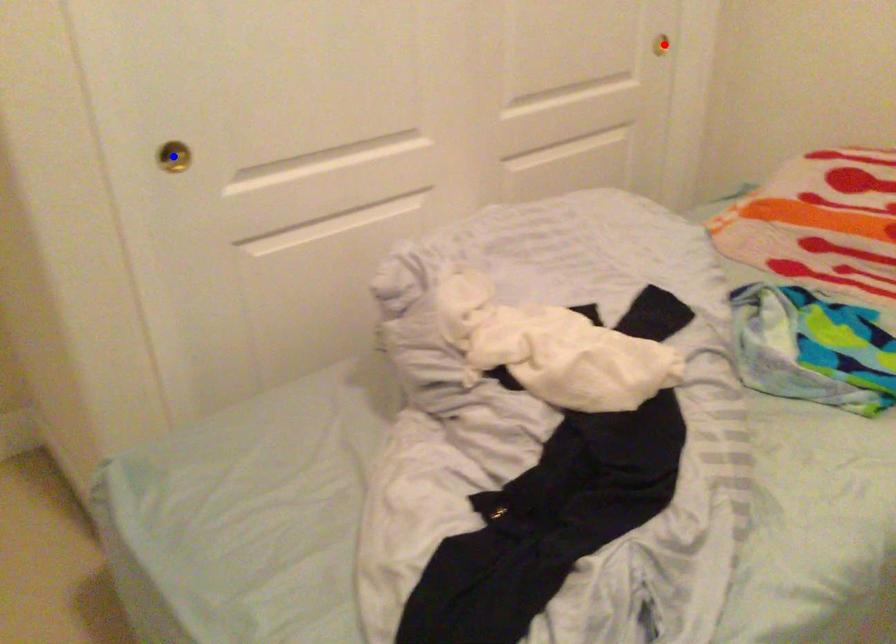
Question: Two points are marked on the image. Which point is closer to the camera?

Choices:
 (A) Blue point is closer.
 (B) Red point is closer.

Answer: (A)